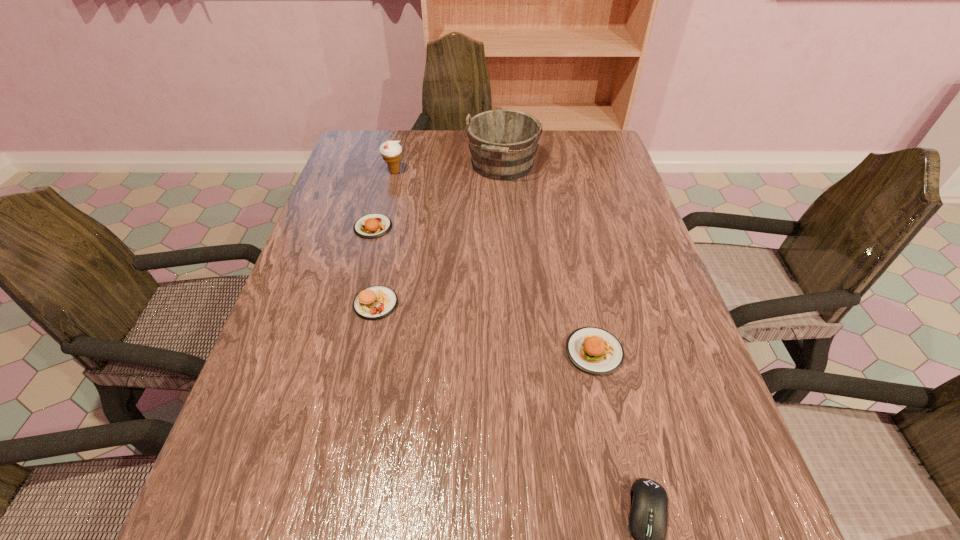
The width and height of the screenshot is (960, 540). I want to click on free space between the third tallest object and the tallest object, so click(x=439, y=234).

Where is `the fourth closest object to the shortest patty (food)`? the fourth closest object to the shortest patty (food) is located at coordinates (594, 350).

Identify the location of the second closest object to the rightmost patty (food). Image resolution: width=960 pixels, height=540 pixels. (376, 302).

Identify which patty (food) is the third nearest to the second tallest object. Please provide its 2D coordinates. Your answer should be formatted as a tuple, i.e. [(x, y)], where the tuple contains the x and y coordinates of a point satisfying the conditions above.

[(594, 350)]

Locate an element on the screen. The width and height of the screenshot is (960, 540). patty (food) that is the second closest to the shortest patty (food) is located at coordinates pos(594,350).

In order to click on vacant space that satisfies the following two spatial constraints: 1. on the back side of the shortest patty (food); 2. on the right side of the fifth shortest object in this screenshot , I will do `click(388, 172)`.